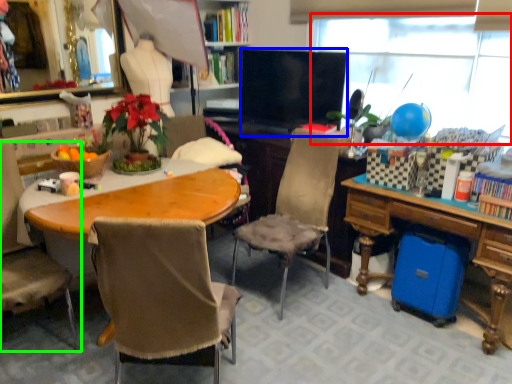
Question: Based on their relative distances, which object is farther from window screen (highlighted by a red box)? Choose from television (highlighted by a blue box) and chair (highlighted by a green box).

Choices:
 (A) television
 (B) chair

Answer: (B)